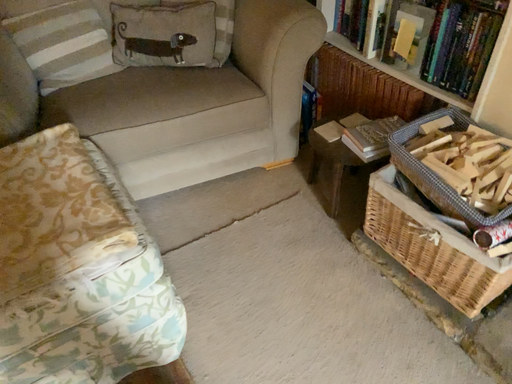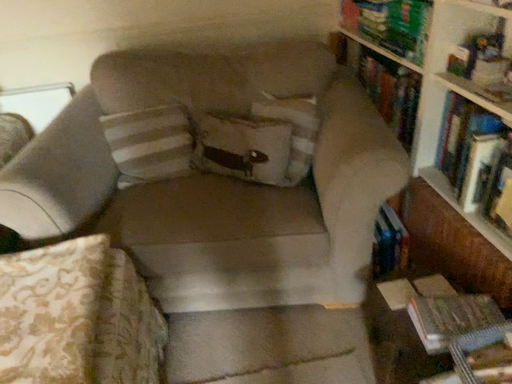
Question: How did the camera likely rotate when shooting the video?

Choices:
 (A) rotated right
 (B) rotated left

Answer: (B)